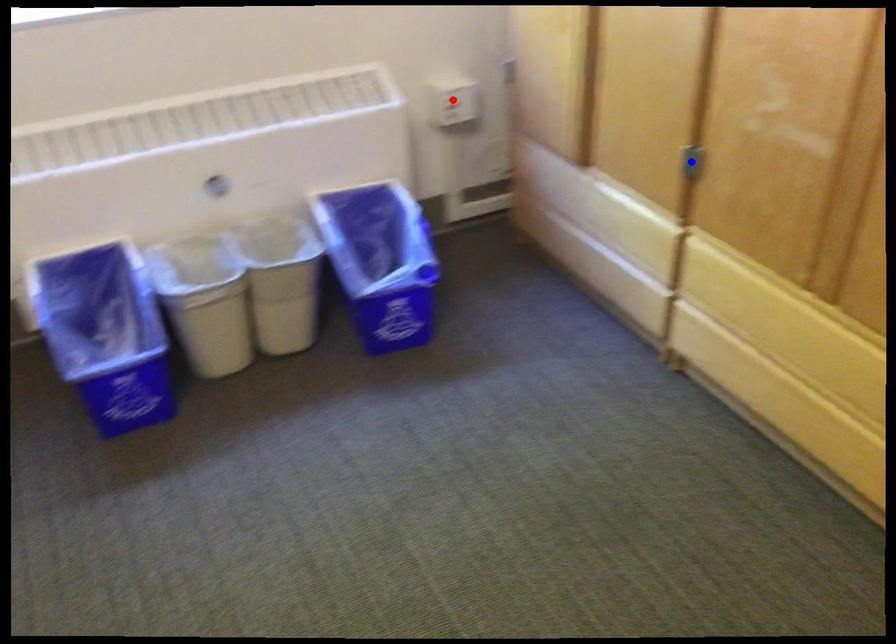
Question: In the image, two points are highlighted. Which point is nearer to the camera? Reply with the corresponding letter.

Choices:
 (A) blue point
 (B) red point

Answer: (A)